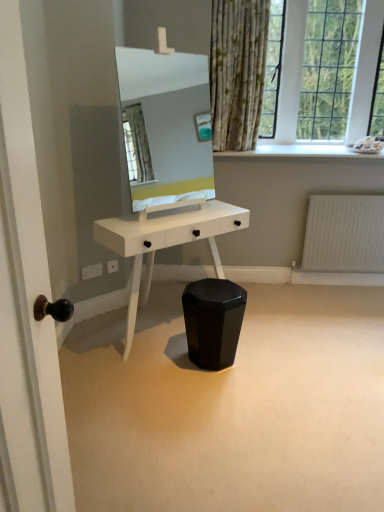
Question: Is white matte radiator at lower right completely or partially outside of black glossy stool at center?

Choices:
 (A) yes
 (B) no

Answer: (A)

Question: Can you confirm if white matte radiator at lower right is thinner than black glossy stool at center?

Choices:
 (A) no
 (B) yes

Answer: (B)

Question: Is white matte radiator at lower right at the left side of black glossy stool at center?

Choices:
 (A) no
 (B) yes

Answer: (A)

Question: Is white matte radiator at lower right not near black glossy stool at center?

Choices:
 (A) no
 (B) yes

Answer: (B)

Question: From the image's perspective, is white matte radiator at lower right above black glossy stool at center?

Choices:
 (A) yes
 (B) no

Answer: (A)

Question: From a real-world perspective, is black glossy stool at center positioned above or below white matte radiator at lower right?

Choices:
 (A) above
 (B) below

Answer: (B)

Question: Is black glossy stool at center spatially inside white matte radiator at lower right, or outside of it?

Choices:
 (A) inside
 (B) outside

Answer: (B)

Question: In terms of size, does black glossy stool at center appear bigger or smaller than white matte radiator at lower right?

Choices:
 (A) small
 (B) big

Answer: (B)

Question: Looking at their shapes, would you say black glossy stool at center is wider or thinner than white matte radiator at lower right?

Choices:
 (A) thin
 (B) wide

Answer: (B)

Question: Is point (374, 53) positioned closer to the camera than point (132, 109)?

Choices:
 (A) farther
 (B) closer

Answer: (B)

Question: Considering their positions, is clear glass window at upper right located in front of or behind white glossy mirror at center?

Choices:
 (A) behind
 (B) front

Answer: (A)

Question: From a real-world perspective, is clear glass window at upper right physically located above or below white glossy mirror at center?

Choices:
 (A) above
 (B) below

Answer: (A)

Question: From their relative heights in the image, would you say clear glass window at upper right is taller or shorter than white glossy mirror at center?

Choices:
 (A) tall
 (B) short

Answer: (A)

Question: From a real-world perspective, is white glossy mirror at center physically located above or below black glossy stool at center?

Choices:
 (A) below
 (B) above

Answer: (B)

Question: Is white glossy mirror at center bigger or smaller than black glossy stool at center?

Choices:
 (A) big
 (B) small

Answer: (A)